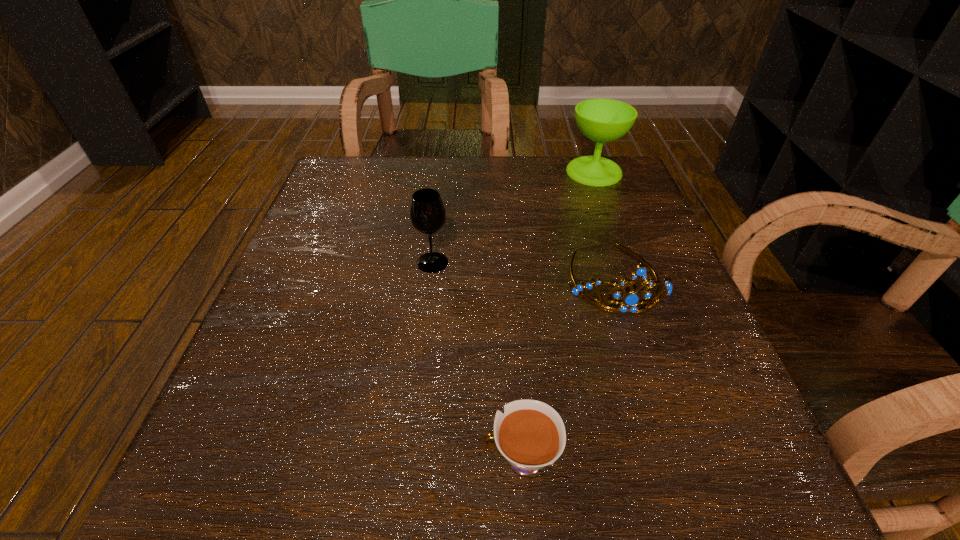
This screenshot has width=960, height=540. In order to click on free spot located 0.230m on the side of the shortest object with the handle in this screenshot , I will do `click(302, 459)`.

This screenshot has height=540, width=960. Find the location of `vacant space located 0.080m on the side of the shortest object with the handle`. vacant space located 0.080m on the side of the shortest object with the handle is located at coordinates (420, 459).

In order to click on vacant space located 0.270m on the side of the shortest object with the handle in this screenshot , I will do `click(271, 459)`.

The image size is (960, 540). I want to click on object at the far edge, so click(x=602, y=120).

Where is `object that is positioned at the near edge`? object that is positioned at the near edge is located at coordinates (530, 435).

The width and height of the screenshot is (960, 540). In order to click on wineglass present at the right edge in this screenshot , I will do `click(602, 120)`.

The image size is (960, 540). I want to click on tiara that is positioned at the right edge, so click(629, 303).

In order to click on object positioned at the far right corner in this screenshot , I will do `click(602, 120)`.

This screenshot has width=960, height=540. I want to click on vacant space at the far edge of the desktop, so click(x=426, y=172).

The width and height of the screenshot is (960, 540). I want to click on vacant point at the near edge, so click(x=455, y=445).